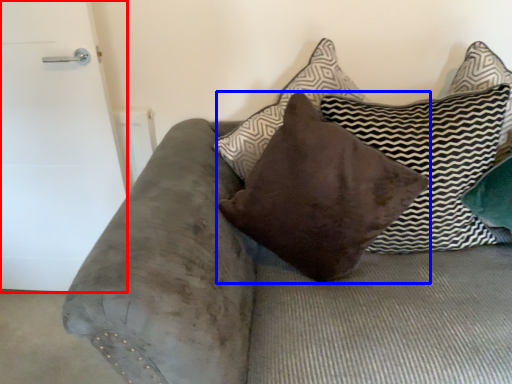
Question: Which object appears farthest to the camera in this image, door (highlighted by a red box) or pillow (highlighted by a blue box)?

Choices:
 (A) door
 (B) pillow

Answer: (A)